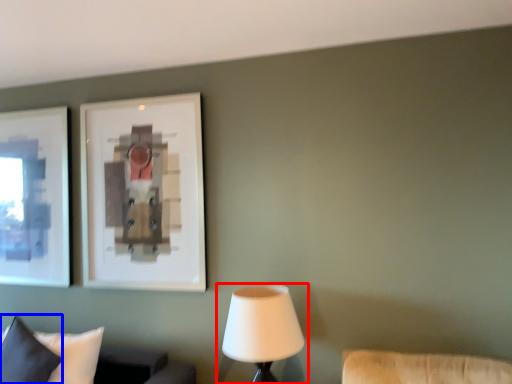
Question: Which object appears farthest to the camera in this image, lamp (highlighted by a red box) or pillow (highlighted by a blue box)?

Choices:
 (A) lamp
 (B) pillow

Answer: (B)